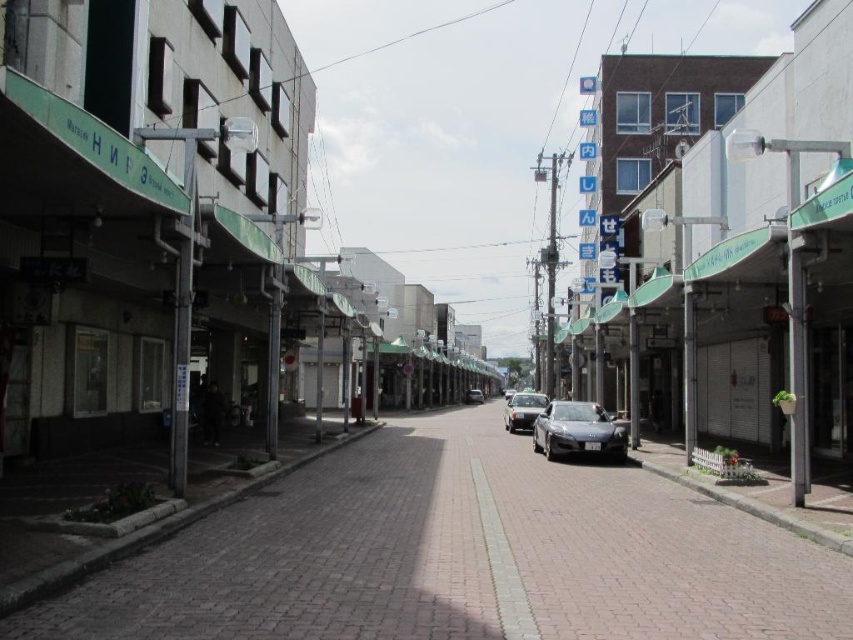
You are a pedestrian standing at the edge of the street. You see a shiny silver car at center and a satin black car at center. How far apart are these two cars from each other?

The shiny silver car at center is 8.10 meters away from the satin black car at center.

From the picture: You are a pedestrian standing on the sidewalk and want to cross the street to reach the shiny silver car at center and the satin black car at center. Which car should you approach first to get to the one farther away?

You should first approach the satin black car at center because the shiny silver car at center is closer to you, so the satin black car at center is farther away and requires reaching it after the closer one.

You are standing at the point with coordinates point (566, 410) and want to walk to the point with coordinates point (474, 516). Which direction should you move relative to your current position?

You should move forward because point (474, 516) is in front of point (566, 410) according to the spatial relationship provided.